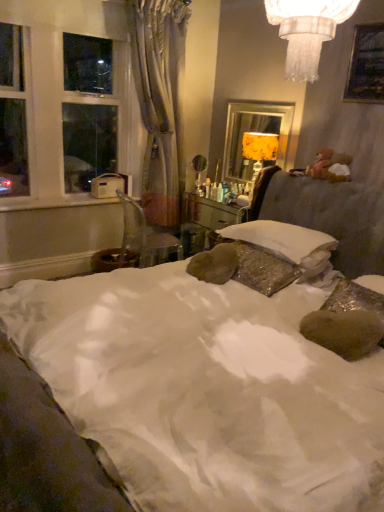
Image resolution: width=384 pixels, height=512 pixels. Describe the element at coordinates (160, 102) in the screenshot. I see `silvery drapery at left` at that location.

This screenshot has width=384, height=512. Find the location of `white plastic window frame at left`. white plastic window frame at left is located at coordinates (61, 108).

What is the approximate height of gold textured lampshade at upper right?

It is 29.19 inches.

Where is `gold textured lampshade at upper right`? This screenshot has width=384, height=512. gold textured lampshade at upper right is located at coordinates (254, 132).

What do you see at coordinates (284, 241) in the screenshot? I see `white soft pillow at center` at bounding box center [284, 241].

Find the location of a particular element. The height and width of the screenshot is (512, 384). silvery drapery at left is located at coordinates (x=160, y=102).

Is silvery drapery at left completely or partially outside of white soft pillow at center?

Yes, silvery drapery at left is not within white soft pillow at center.

From the image's perspective, which one is positioned lower, silvery drapery at left or white soft pillow at center?

From the image's view, white soft pillow at center is below.

Is silvery drapery at left thinner than white soft pillow at center?

Correct, the width of silvery drapery at left is less than that of white soft pillow at center.

Does transparent plastic chair at center turn towards silvery drapery at left?

No, transparent plastic chair at center is not facing towards silvery drapery at left.

Considering the sizes of objects transparent plastic chair at center and silvery drapery at left in the image provided, who is wider, transparent plastic chair at center or silvery drapery at left?

transparent plastic chair at center is wider.

Which object is closer to the camera taking this photo, transparent plastic chair at center or silvery drapery at left?

silvery drapery at left is more forward.

Is point (132, 234) positioned in front of point (153, 48)?

No, (132, 234) is further to viewer.

Does point (335, 244) come in front of point (150, 474)?

No, (335, 244) is further to viewer.

Can we say white soft pillow at center lies outside white satin bed at center?

No, most part of white soft pillow at center lies within white satin bed at center.

Is white soft pillow at center at the right side of white satin bed at center?

Yes, white soft pillow at center is to the right of white satin bed at center.

Is white satin bed at center far away from white plastic window frame at left?

white satin bed at center is positioned a significant distance from white plastic window frame at left.

Is white satin bed at center looking in the opposite direction of white plastic window frame at left?

No, white satin bed at center is not facing the opposite direction of white plastic window frame at left.

Would you say white satin bed at center is outside white plastic window frame at left?

white satin bed at center lies outside white plastic window frame at left's area.

From the image's perspective, between white satin bed at center and white plastic window frame at left, which one is located above?

white plastic window frame at left.

Considering the points (127, 74) and (148, 173), which point is in front, point (127, 74) or point (148, 173)?

The point (127, 74) is more forward.

Can we say white plastic window frame at left lies outside silvery drapery at left?

Yes, white plastic window frame at left is located beyond the bounds of silvery drapery at left.

Between white plastic window frame at left and silvery drapery at left, which one has larger width?

silvery drapery at left is wider.

Considering the relative positions of white plastic window frame at left and silvery drapery at left in the image provided, is white plastic window frame at left to the left or to the right of silvery drapery at left?

Clearly, white plastic window frame at left is on the left of silvery drapery at left in the image.

From a real-world perspective, who is located lower, silvery drapery at left or gold textured lampshade at upper right?

From a 3D spatial view, gold textured lampshade at upper right is below.

The width and height of the screenshot is (384, 512). I want to click on curtain in front of the gold textured lampshade at upper right, so click(x=160, y=102).

Considering the sizes of objects silvery drapery at left and gold textured lampshade at upper right in the image provided, who is shorter, silvery drapery at left or gold textured lampshade at upper right?

gold textured lampshade at upper right.

Are silvery drapery at left and gold textured lampshade at upper right located far from each other?

No, silvery drapery at left is not far from gold textured lampshade at upper right.

From a real-world perspective, is white soft pillow at center positioned above or below white plastic window sill at left?

From a real-world perspective, white soft pillow at center is physically above white plastic window sill at left.

Does white soft pillow at center turn towards white plastic window sill at left?

No, white soft pillow at center is not facing towards white plastic window sill at left.

Where is `window sill that appears below the white soft pillow at center (from a real-world perspective)`? window sill that appears below the white soft pillow at center (from a real-world perspective) is located at coordinates (53, 202).

Is point (301, 262) in front of point (10, 210)?

Yes, point (301, 262) is in front of point (10, 210).

In the image, there is a silvery drapery at left. Identify the location of pillow below it (from the image's perspective). This screenshot has width=384, height=512. (284, 241).

Where is `curtain located on the right of transparent plastic chair at center`? curtain located on the right of transparent plastic chair at center is located at coordinates (160, 102).

Looking at the image, which one is located closer to silvery drapery at left, white plastic window sill at left or white soft pillow at center?

Based on the image, white plastic window sill at left appears to be nearer to silvery drapery at left.

Which object lies nearer to the anchor point white satin bed at center, transparent plastic chair at center or white plastic window frame at left?

Based on the image, transparent plastic chair at center appears to be nearer to white satin bed at center.

When comparing their distances from white plastic window sill at left, does silvery drapery at left or transparent plastic chair at center seem further?

Based on the image, silvery drapery at left appears to be further to white plastic window sill at left.

Based on their spatial positions, is white satin bed at center or white plastic window sill at left closer to gold textured lampshade at upper right?

white plastic window sill at left is positioned closer to the anchor gold textured lampshade at upper right.

Considering their positions, is gold textured lampshade at upper right positioned closer to white satin bed at center than white plastic window sill at left?

gold textured lampshade at upper right lies closer to white satin bed at center than the other object.

Which object lies nearer to the anchor point white plastic window sill at left, gold textured lampshade at upper right or white soft pillow at center?

Based on the image, gold textured lampshade at upper right appears to be nearer to white plastic window sill at left.

When comparing their distances from gold textured lampshade at upper right, does white plastic window frame at left or silvery drapery at left seem further?

Based on the image, white plastic window frame at left appears to be further to gold textured lampshade at upper right.

Looking at the image, which one is located closer to white soft pillow at center, white plastic window sill at left or white plastic window frame at left?

white plastic window sill at left is closer to white soft pillow at center.

This screenshot has height=512, width=384. I want to click on pillow between white satin bed at center and gold textured lampshade at upper right along the z-axis, so click(284, 241).

Where is `window sill between silvery drapery at left and transparent plastic chair at center in the vertical direction`? This screenshot has height=512, width=384. window sill between silvery drapery at left and transparent plastic chair at center in the vertical direction is located at coordinates (53, 202).

What are the coordinates of `chair located between white plastic window sill at left and white soft pillow at center in the left-right direction` in the screenshot? It's located at (145, 238).

Find the location of `chair located between white plastic window frame at left and white soft pillow at center in the left-right direction`. chair located between white plastic window frame at left and white soft pillow at center in the left-right direction is located at coordinates (145, 238).